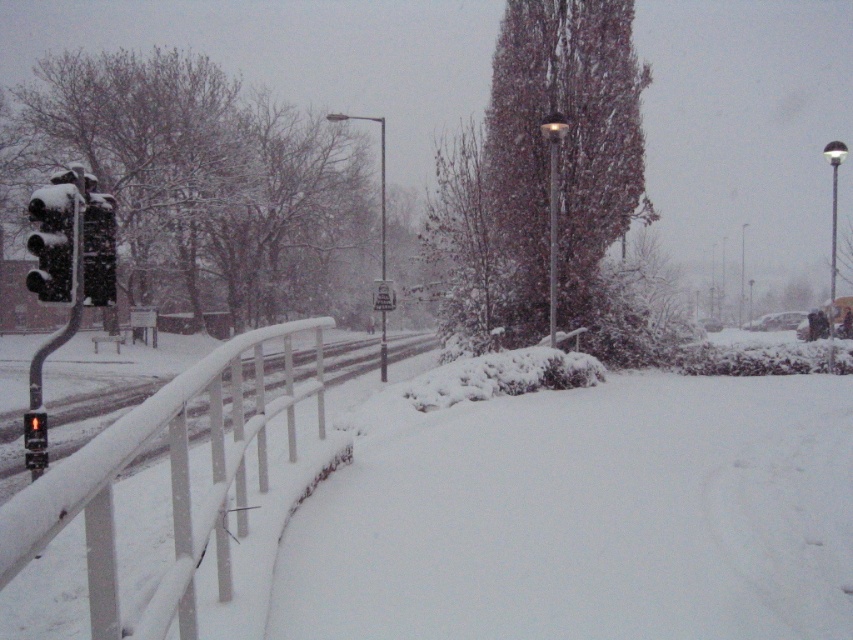
You are standing at the center of the snowy road and see two points marked in the image. Which point, point (171, 483) or point (97, 211), is closer to you?

Point (171, 483) is closer to the camera than point (97, 211), so it is closer to you as well.

You are a delivery drone flying over a snowy street. You need to land on the white fluffy snow at center without hitting the black matte traffic light at left. Is the snow at center located below the traffic light?

Yes, the white fluffy snow at center is positioned under the black matte traffic light at left, so it is safe to land there without hitting the traffic light.